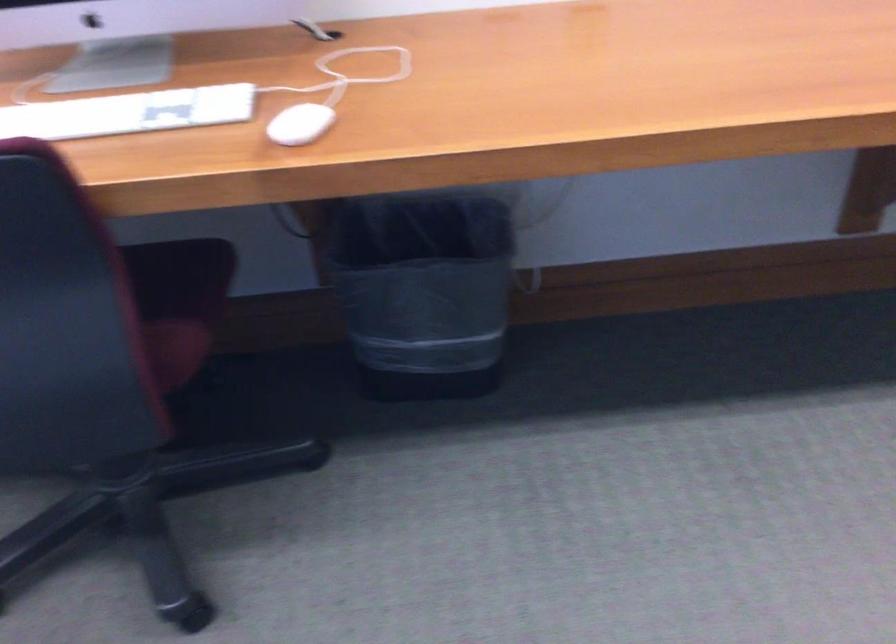
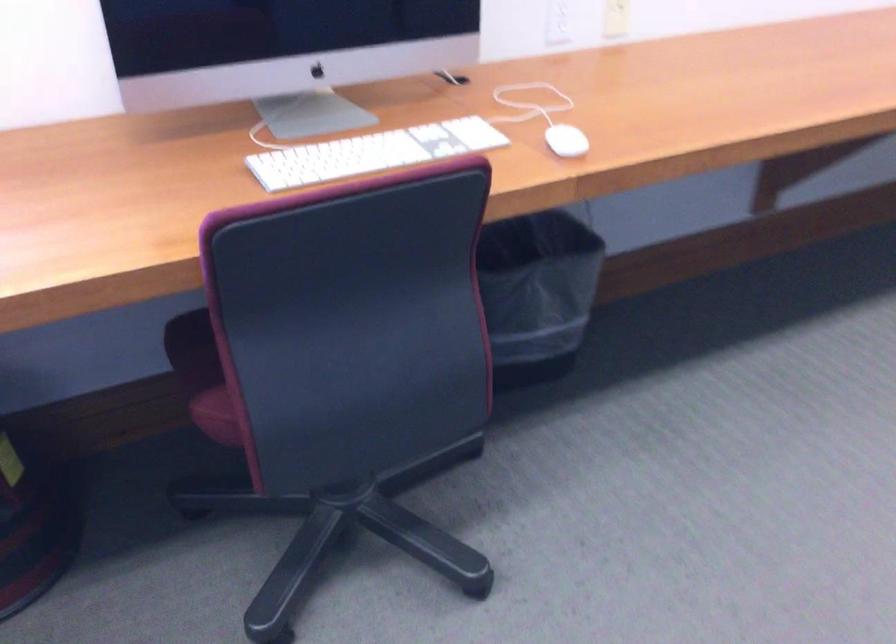
The point at (405, 299) is marked in the first image. Where is the corresponding point in the second image?

(536, 292)